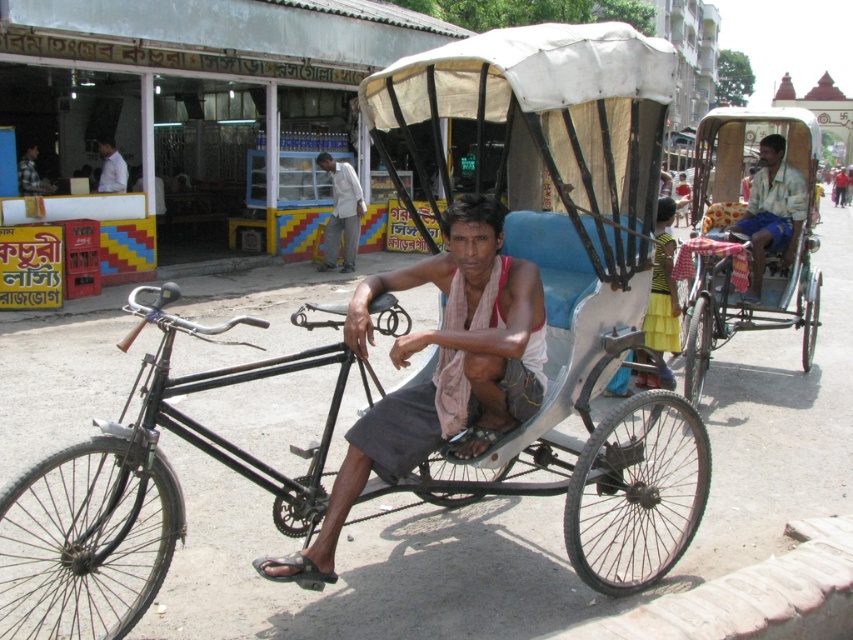
You are a delivery person who needs to pick up a package from the black matte bicycle at center. You are currently standing at point [137,493]. Can you reach the black matte bicycle at center from your current position?

Yes, you are already at the location of the black matte bicycle at center since the point [137,493] is where it is located.

Based on the scene description, what are the coordinates of the white fabric rickshaw at center?

The white fabric rickshaw at center is located at coordinates (573, 272).